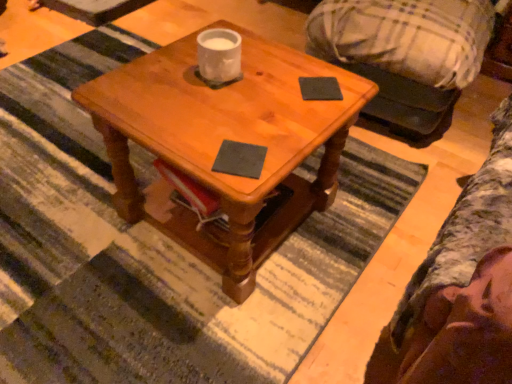
In order to click on unoccupied region to the right of dark gray matte notepad at center, which is the second notepad from top to bottom in this screenshot , I will do `click(293, 148)`.